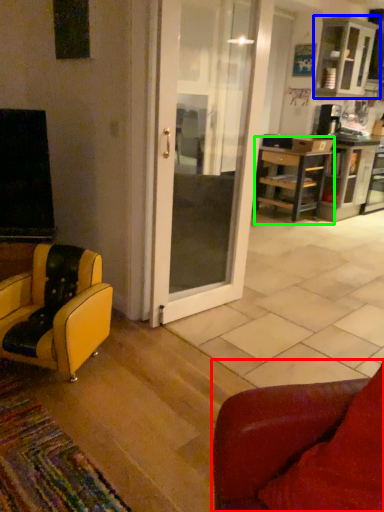
Question: Based on their relative distances, which object is nearer to chair (highlighted by a red box)? Choose from cabinetry (highlighted by a blue box) and desk (highlighted by a green box).

Choices:
 (A) cabinetry
 (B) desk

Answer: (B)